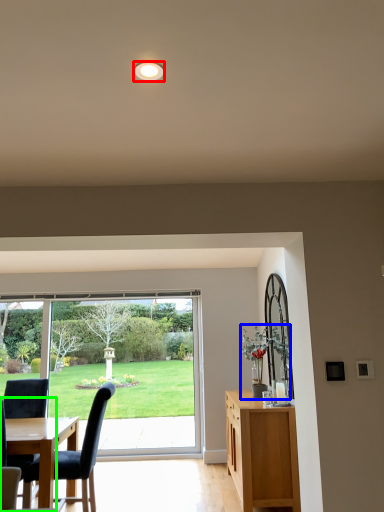
Question: Estimate the real-world distances between objects in this image. Which object is farther from lighting (highlighted by a red box), houseplant (highlighted by a blue box) or chair (highlighted by a green box)?

Choices:
 (A) houseplant
 (B) chair

Answer: (A)